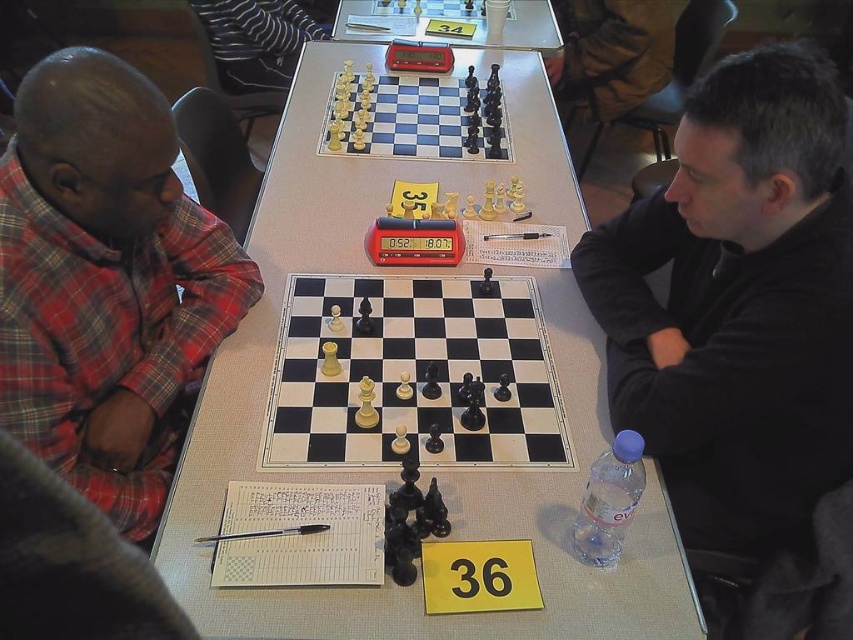
Question: Is plaid fabric shirt at left closer to camera compared to wooden chessboard at center?

Choices:
 (A) no
 (B) yes

Answer: (B)

Question: Observing the image, what is the correct spatial positioning of white glossy chessboard at center in reference to plaid fabric shirt at left?

Choices:
 (A) left
 (B) right

Answer: (B)

Question: Which object appears closest to the camera in this image?

Choices:
 (A) wooden chess set at center
 (B) black matte shirt at center

Answer: (B)

Question: Is white glossy chessboard at center positioned in front of wooden chessboard at center?

Choices:
 (A) yes
 (B) no

Answer: (A)

Question: Which of the following is the farthest from the observer?

Choices:
 (A) (442, 20)
 (B) (76, 387)

Answer: (A)

Question: Which point appears farthest from the camera in this image?

Choices:
 (A) (364, 32)
 (B) (444, 112)
 (C) (56, 173)
 (D) (814, 420)

Answer: (A)